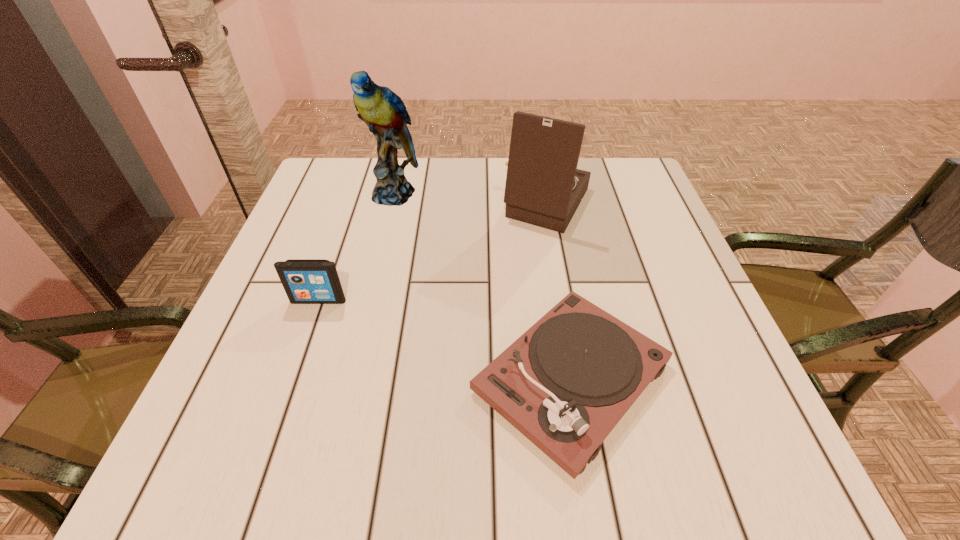
Identify the location of parrot positioned at the far edge. (383, 111).

Image resolution: width=960 pixels, height=540 pixels. What are the coordinates of `phonograph record positioned at the far edge` in the screenshot? It's located at (544, 188).

You are a GUI agent. You are given a task and a screenshot of the screen. Output one action in this format:
    pyautogui.click(x=<x>, y=<y>)
    Task: Click on the object located at the near edge
    The width and height of the screenshot is (960, 540).
    Given the screenshot: What is the action you would take?
    pyautogui.click(x=565, y=383)

Where is `parrot located at the left edge`? parrot located at the left edge is located at coordinates (383, 111).

This screenshot has height=540, width=960. I want to click on iPod present at the left edge, so click(306, 281).

Image resolution: width=960 pixels, height=540 pixels. Find the location of `object that is at the far left corner`. object that is at the far left corner is located at coordinates (383, 111).

You are a GUI agent. You are given a task and a screenshot of the screen. Output one action in this format:
    pyautogui.click(x=<x>, y=<y>)
    Task: Click on the object that is at the far right corner
    This screenshot has height=540, width=960.
    Given the screenshot: What is the action you would take?
    pyautogui.click(x=544, y=188)

This screenshot has height=540, width=960. Identify the location of object present at the near right corner. (565, 383).

This screenshot has height=540, width=960. In order to click on blank space at the far edge of the desktop in this screenshot , I will do `click(490, 158)`.

You are a GUI agent. You are given a task and a screenshot of the screen. Output one action in this format:
    pyautogui.click(x=<x>, y=<y>)
    Task: Click on the vacant region at the near edge
    The image size is (960, 540).
    Given the screenshot: What is the action you would take?
    pyautogui.click(x=505, y=447)